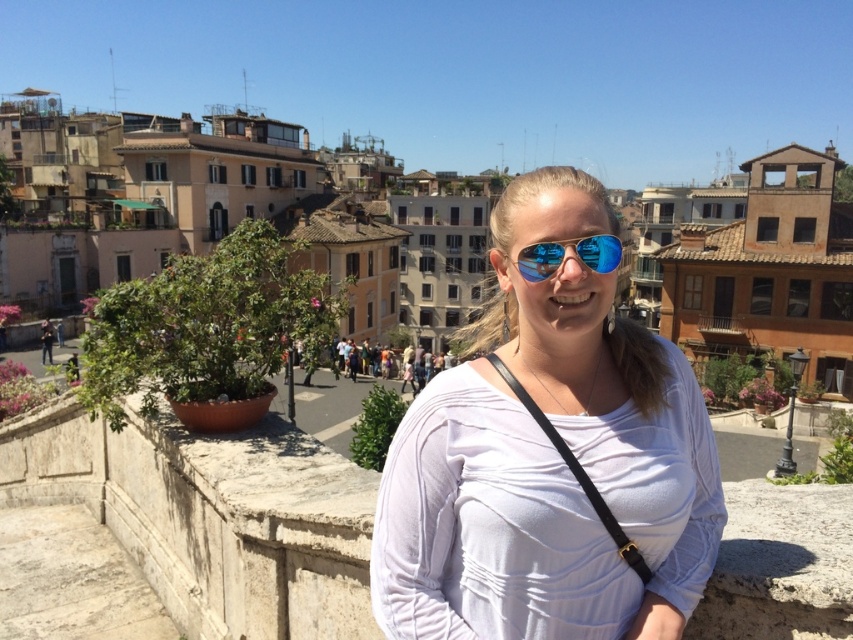
Between point (393, 460) and point (822, 504), which one is positioned behind?

Positioned behind is point (822, 504).

Is white matte shirt at center closer to camera compared to white stone ledge at center?

No.

Find the location of `white matte shirt at center`. white matte shirt at center is located at coordinates (548, 460).

Locate an element on the screen. white matte shirt at center is located at coordinates (548, 460).

Consider the image. Does white matte shirt at center appear on the left side of reflective blue aviator sunglasses at center?

In fact, white matte shirt at center is to the right of reflective blue aviator sunglasses at center.

Measure the distance between white matte shirt at center and camera.

white matte shirt at center and camera are 11.35 meters apart from each other.

Where is `white matte shirt at center`? The height and width of the screenshot is (640, 853). white matte shirt at center is located at coordinates (548, 460).

Can you confirm if white stone ledge at center is positioned to the left of reflective blue aviator sunglasses at center?

Yes, white stone ledge at center is to the left of reflective blue aviator sunglasses at center.

Can you confirm if white stone ledge at center is taller than reflective blue aviator sunglasses at center?

Yes.

Between point (230, 556) and point (543, 275), which one is positioned behind?

The point (230, 556) is behind.

Find the location of a particular element. This screenshot has width=853, height=640. white stone ledge at center is located at coordinates (212, 516).